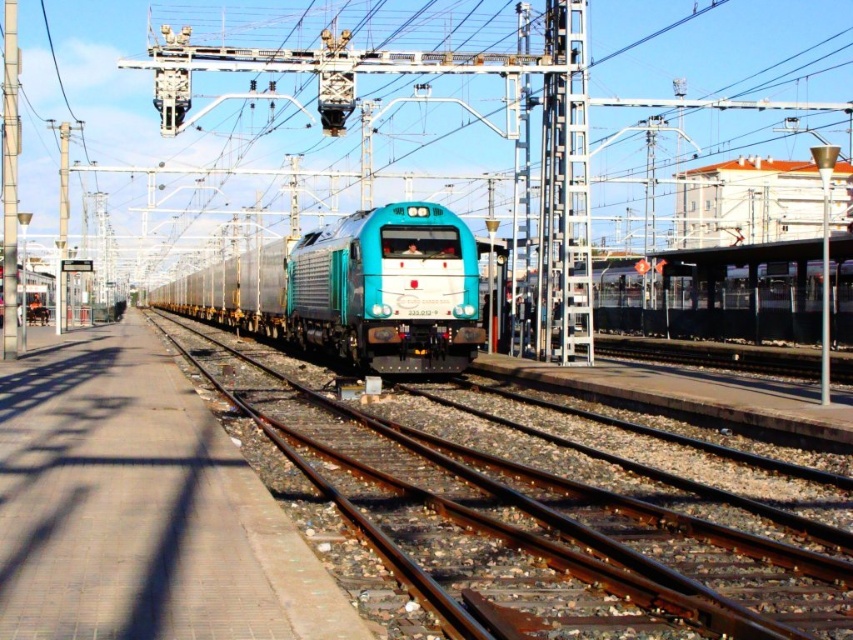
Question: Does teal glossy locomotive at center appear over brushed metal pole at left?

Choices:
 (A) no
 (B) yes

Answer: (A)

Question: Which point is closer to the camera taking this photo?

Choices:
 (A) (552, 561)
 (B) (6, 275)

Answer: (A)

Question: Does teal glossy locomotive at center have a smaller size compared to brushed metal pole at left?

Choices:
 (A) no
 (B) yes

Answer: (A)

Question: Considering the real-world distances, which object is farthest from the teal glossy locomotive at center?

Choices:
 (A) brushed metal pole at left
 (B) brown metal train track at center

Answer: (A)

Question: Can you confirm if brown metal train track at center is positioned above teal glossy locomotive at center?

Choices:
 (A) no
 (B) yes

Answer: (A)

Question: Estimate the real-world distances between objects in this image. Which object is closer to the brushed metal pole at left?

Choices:
 (A) teal glossy locomotive at center
 (B) brown metal train track at center

Answer: (B)